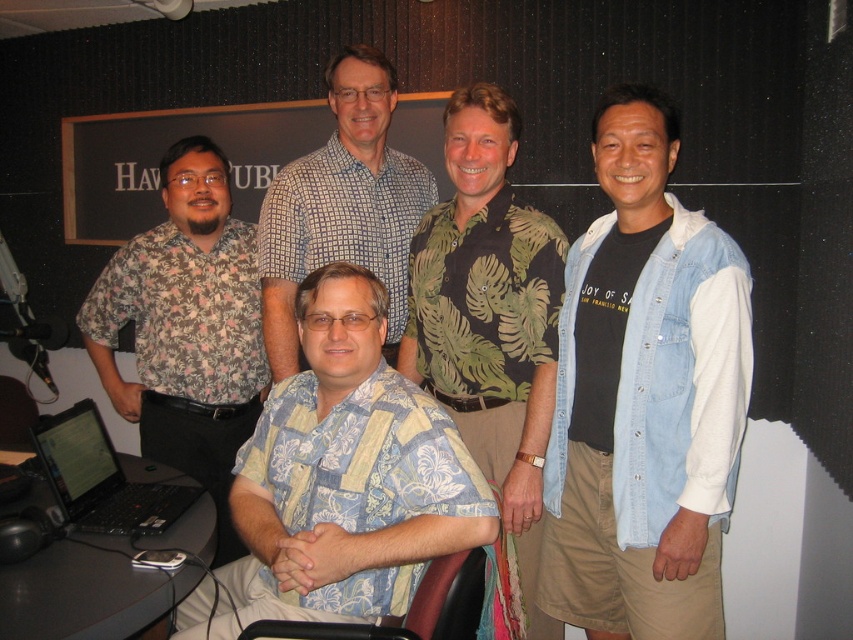
In the scene shown: Does blue floral shirt at center have a greater height compared to green leafy shirt at center?

No, blue floral shirt at center is not taller than green leafy shirt at center.

Can you confirm if blue floral shirt at center is bigger than green leafy shirt at center?

Incorrect, blue floral shirt at center is not larger than green leafy shirt at center.

Is point (294, 413) more distant than point (506, 456)?

That is False.

I want to click on blue floral shirt at center, so click(x=341, y=481).

Which is in front, point (572, 348) or point (233, 346)?

Positioned in front is point (572, 348).

Who is more distant from viewer, [544,556] or [254,355]?

Point [254,355]

At what (x,y) coordinates should I click in order to perform the action: click on denim vest at right. Please return your answer as a coordinate pair (x, y). Looking at the image, I should click on (643, 396).

Where is `denim vest at right`? denim vest at right is located at coordinates (643, 396).

Does blue floral shirt at center appear over black glossy laptop at lower left?

Yes.

Does point (276, 516) lie behind point (141, 532)?

No, (276, 516) is closer to viewer.

Who is more distant from viewer, (234, 579) or (144, 484)?

Point (144, 484)

The image size is (853, 640). What are the coordinates of `blue floral shirt at center` in the screenshot? It's located at (341, 481).